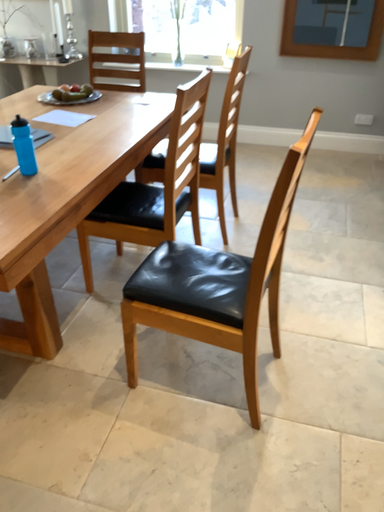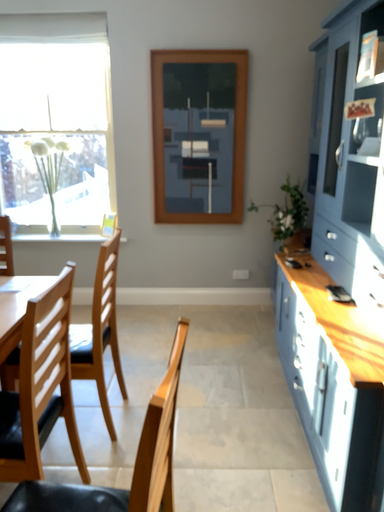
Question: How did the camera likely rotate when shooting the video?

Choices:
 (A) rotated downward
 (B) rotated upward

Answer: (B)